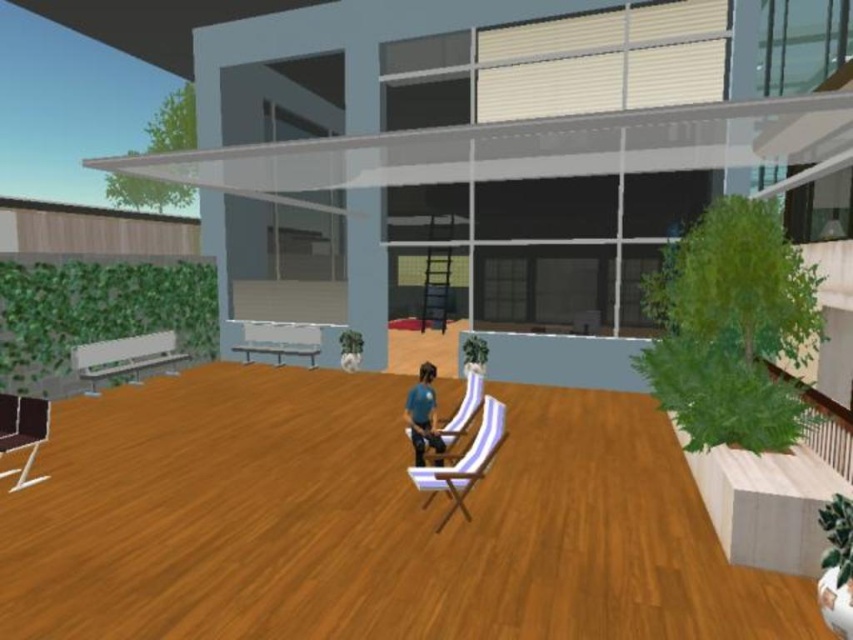
Question: Can you confirm if striped fabric chair at center is bigger than dark brown leather armchair at lower left?

Choices:
 (A) yes
 (B) no

Answer: (B)

Question: Where is dark brown leather armchair at lower left located in relation to blue fabric chair at center in the image?

Choices:
 (A) above
 (B) below

Answer: (B)

Question: Among these points, which one is farthest from the camera?

Choices:
 (A) (419, 365)
 (B) (444, 492)
 (C) (4, 436)

Answer: (A)

Question: Which of the following is the closest to the observer?

Choices:
 (A) blue fabric chair at center
 (B) dark brown leather armchair at lower left
 (C) striped fabric chair at center

Answer: (C)

Question: Considering the real-world distances, which object is closest to the dark brown leather armchair at lower left?

Choices:
 (A) blue fabric chair at center
 (B) striped fabric chair at center

Answer: (A)

Question: Is dark brown leather armchair at lower left bigger than blue fabric chair at center?

Choices:
 (A) no
 (B) yes

Answer: (B)